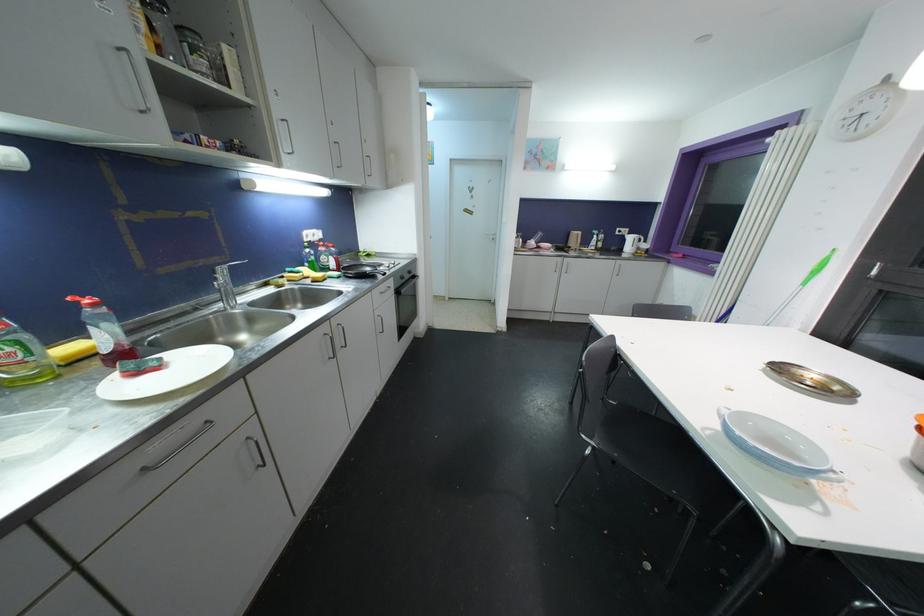
Which object does [629,241] point to?

This point indicates the white electric kettle.